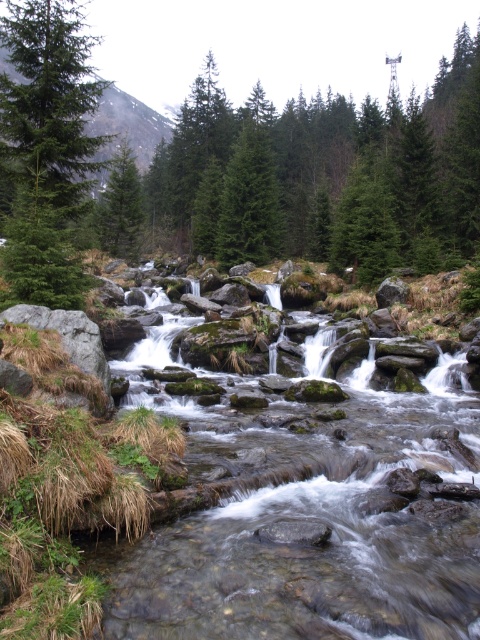
You are a hiker trying to cross the stream using the smooth gray rocks at center. There is also a green matte evergreen tree at center nearby. Which object is narrower, allowing you to pass through more easily?

The smooth gray rocks at center are thinner than the green matte evergreen tree at center, so you can pass through more easily between the smooth gray rocks at center.

You are standing near a stream in a forest and want to cross it to reach the other side. You notice smooth gray rocks at center in the middle of the stream. If your average step length is 0.75 meters, how many steps would it take you to cross the stream using these rocks?

The distance between the smooth gray rocks at center and the viewer is 3.49 meters. With an average step length of 0.75 meters, you would need approximately 5 steps to cross the stream, as 3.49 divided by 0.75 equals roughly 4.65, which rounds up to 5 steps.

You are standing at the edge of the stream and want to place a small decorative rock at each of the two points labeled point (x=82, y=33) and point (x=98, y=211). Which point will appear larger in your view?

Point (x=82, y=33) will appear larger in your view because it is closer to the camera than point (x=98, y=211).